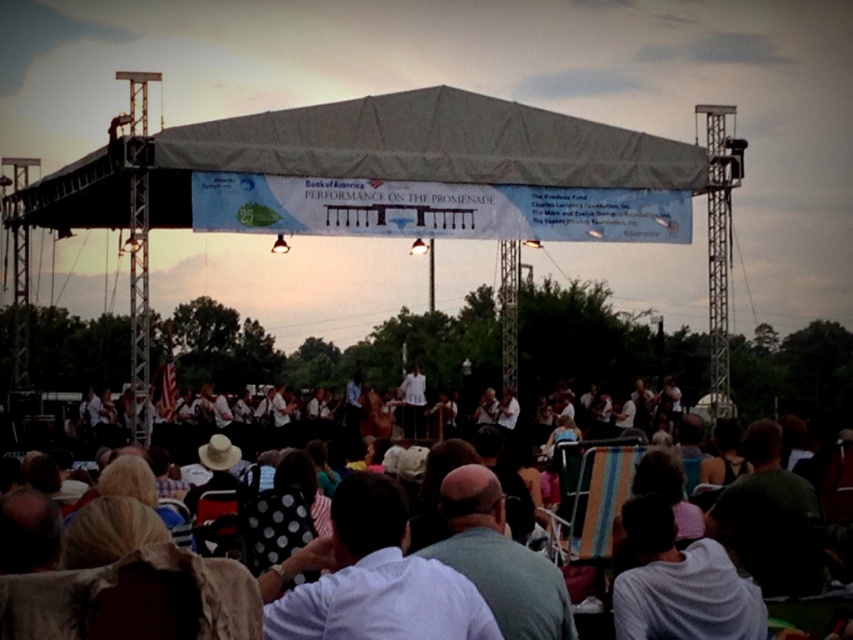
Which is behind, point (792, 474) or point (448, 602)?

The point (792, 474) is behind.

The image size is (853, 640). Identify the location of white fabric orchestra at center. (782, 516).

At what (x,y) coordinates should I click in order to perform the action: click on white fabric orchestra at center. Please return your answer as a coordinate pair (x, y). Looking at the image, I should click on (782, 516).

Is gray fabric canopy at center positioned at the back of dark green shirt at lower right?

Yes, gray fabric canopy at center is behind dark green shirt at lower right.

This screenshot has height=640, width=853. Describe the element at coordinates (422, 147) in the screenshot. I see `gray fabric canopy at center` at that location.

This screenshot has width=853, height=640. I want to click on gray fabric canopy at center, so click(x=422, y=147).

Between white cotton shirt at lower right and dark green shirt at lower right, which one is positioned lower?

white cotton shirt at lower right

Is point (746, 627) positioned behind point (778, 452)?

No, it is not.

This screenshot has height=640, width=853. Identify the location of white cotton shirt at lower right. (680, 582).